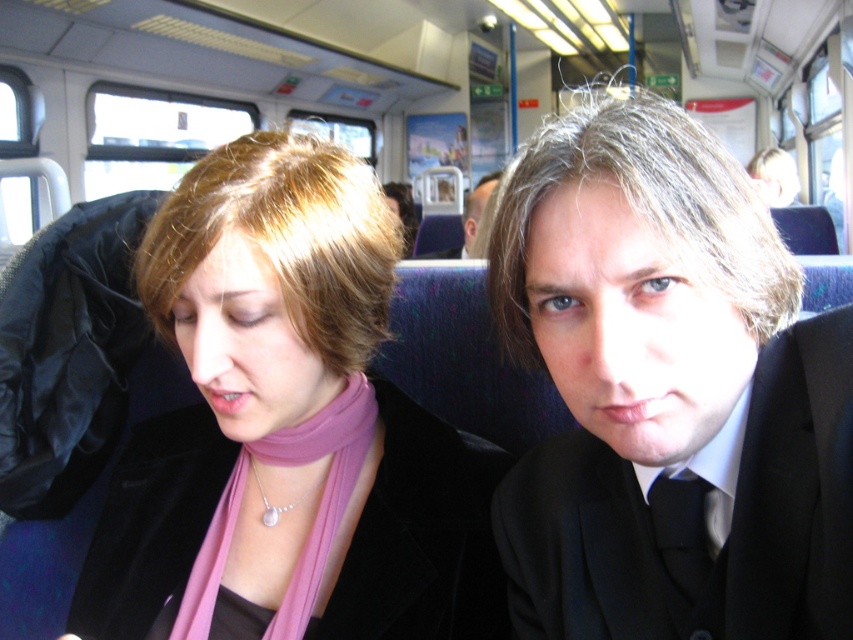
Which is above, pink silk scarf at center or smooth black suit at center?

smooth black suit at center

Is pink silk scarf at center smaller than smooth black suit at center?

Yes, pink silk scarf at center is smaller than smooth black suit at center.

Does point (212, 595) lie behind point (474, 230)?

No, (212, 595) is in front of (474, 230).

The height and width of the screenshot is (640, 853). I want to click on pink silk scarf at center, so click(x=311, y=524).

Is pink fabric scarf at center further to the viewer compared to pink silk scarf at center?

No, pink fabric scarf at center is in front of pink silk scarf at center.

Locate an element on the screen. The width and height of the screenshot is (853, 640). pink fabric scarf at center is located at coordinates (315, 403).

Which is more to the right, matte black suit at center or pink silk scarf at center?

Positioned to the right is matte black suit at center.

Does matte black suit at center appear on the right side of pink silk scarf at center?

Correct, you'll find matte black suit at center to the right of pink silk scarf at center.

You are a GUI agent. You are given a task and a screenshot of the screen. Output one action in this format:
    pyautogui.click(x=<x>, y=<y>)
    Task: Click on the matte black suit at center
    The image size is (853, 640).
    Given the screenshot: What is the action you would take?
    pyautogui.click(x=666, y=392)